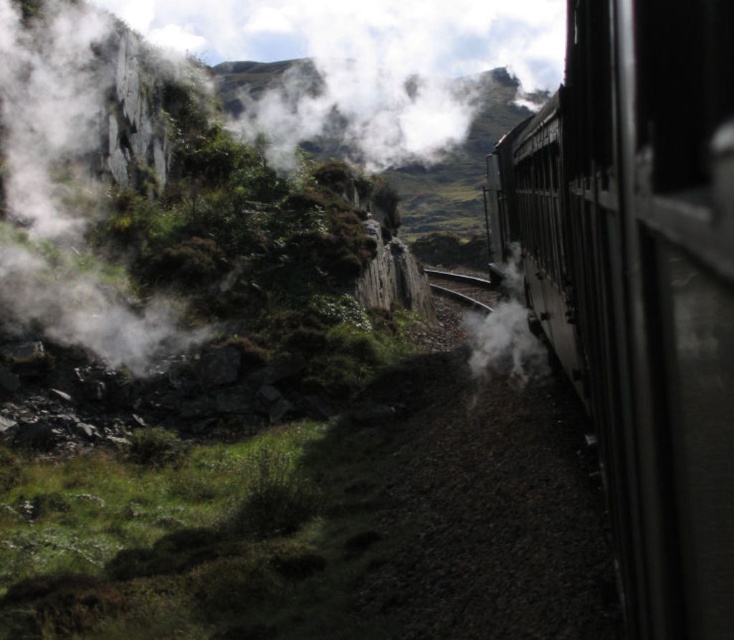
Question: Which object appears farthest from the camera in this image?

Choices:
 (A) white foggy steam at left
 (B) polished metal train at right

Answer: (A)

Question: Which object appears farthest from the camera in this image?

Choices:
 (A) polished metal train at right
 (B) white foggy steam at left

Answer: (B)

Question: Does polished metal train at right appear on the right side of white foggy steam at left?

Choices:
 (A) yes
 (B) no

Answer: (A)

Question: Does polished metal train at right have a greater width compared to white foggy steam at left?

Choices:
 (A) yes
 (B) no

Answer: (B)

Question: Is polished metal train at right wider than white foggy steam at left?

Choices:
 (A) no
 (B) yes

Answer: (A)